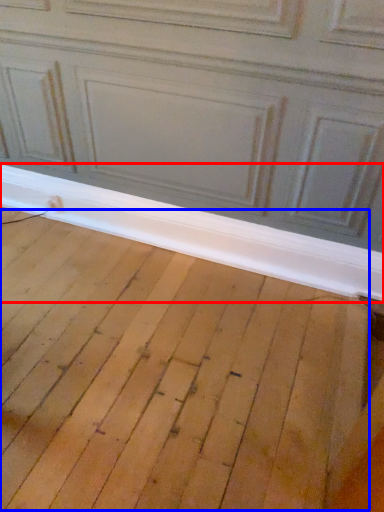
Question: Which point is further to the camera, window sill (highlighted by a red box) or plywood (highlighted by a blue box)?

Choices:
 (A) window sill
 (B) plywood

Answer: (A)